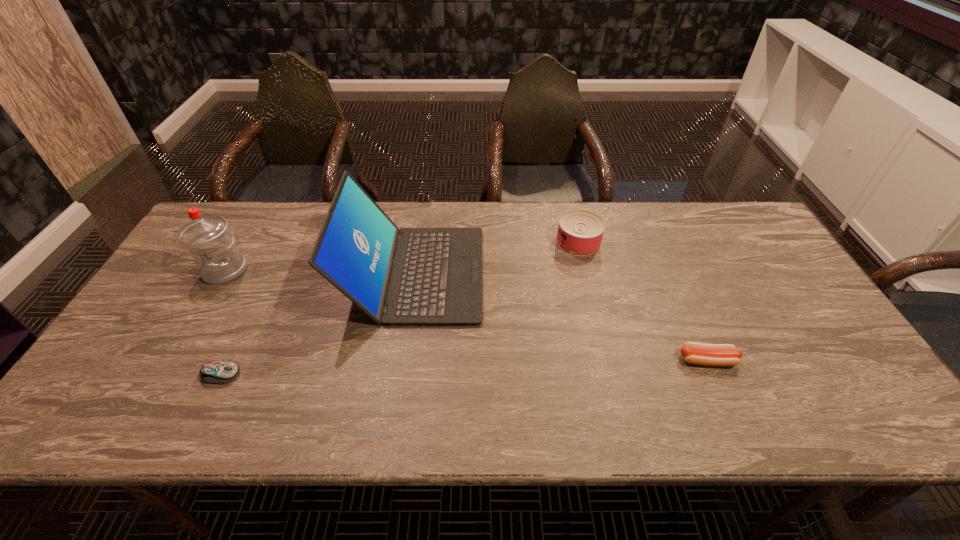
Locate an element on the screen. This screenshot has height=540, width=960. laptop computer is located at coordinates (410, 276).

The height and width of the screenshot is (540, 960). In order to click on water bottle in this screenshot , I will do pos(207,237).

Locate an element on the screen. This screenshot has width=960, height=540. the third tallest object is located at coordinates 580,232.

In order to click on the fourth object from left to right in this screenshot , I will do `click(580, 232)`.

Locate an element on the screen. The width and height of the screenshot is (960, 540). the rightmost object is located at coordinates (697, 353).

Locate an element on the screen. This screenshot has height=540, width=960. the second shortest object is located at coordinates [x=697, y=353].

The width and height of the screenshot is (960, 540). I want to click on computer mouse, so click(217, 372).

This screenshot has width=960, height=540. What are the coordinates of `the shortest object` in the screenshot? It's located at (217, 372).

Identify the location of free space located on the screen of the laptop computer. (611, 274).

Locate an element on the screen. The image size is (960, 540). blank area located on the handle side of the leftmost object is located at coordinates (186, 337).